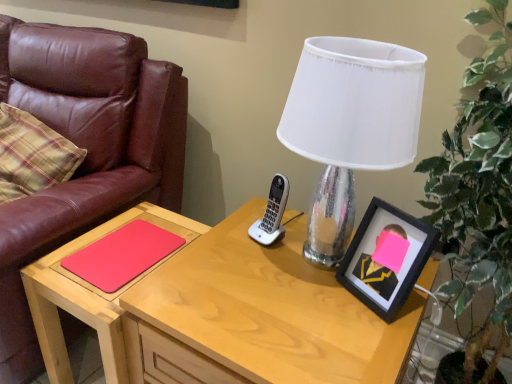
Find the location of a particular element. The height and width of the screenshot is (384, 512). unoccupied area in front of clear glass lamp at center is located at coordinates (307, 330).